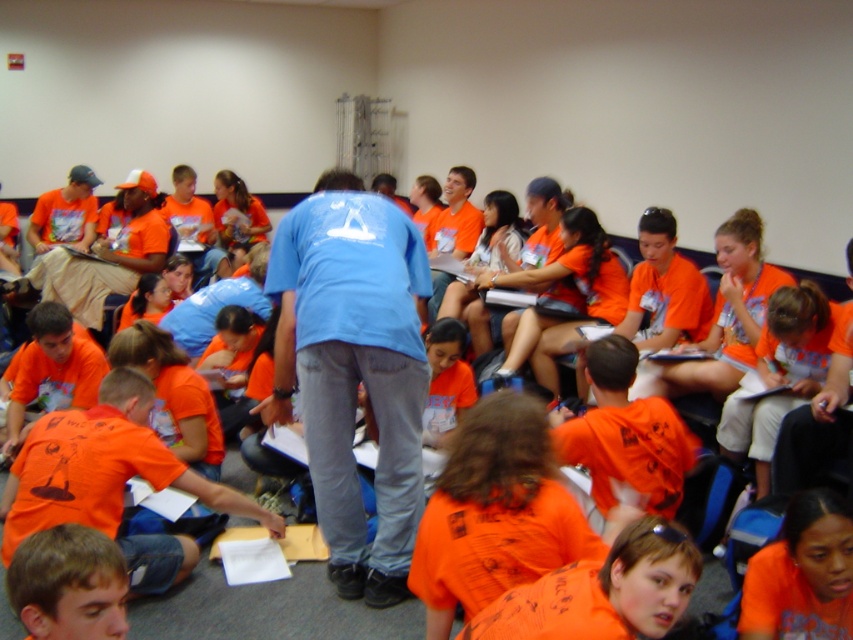
Can you confirm if blue cotton shirt at center is positioned to the left of orange matte shirt at lower right?

Yes, blue cotton shirt at center is to the left of orange matte shirt at lower right.

Is blue cotton shirt at center smaller than orange matte shirt at lower right?

Incorrect, blue cotton shirt at center is not smaller in size than orange matte shirt at lower right.

You are a GUI agent. You are given a task and a screenshot of the screen. Output one action in this format:
    pyautogui.click(x=<x>, y=<y>)
    Task: Click on the blue cotton shirt at center
    The image size is (853, 640).
    Given the screenshot: What is the action you would take?
    pyautogui.click(x=352, y=371)

Find the location of `blue cotton shirt at center`. blue cotton shirt at center is located at coordinates (352, 371).